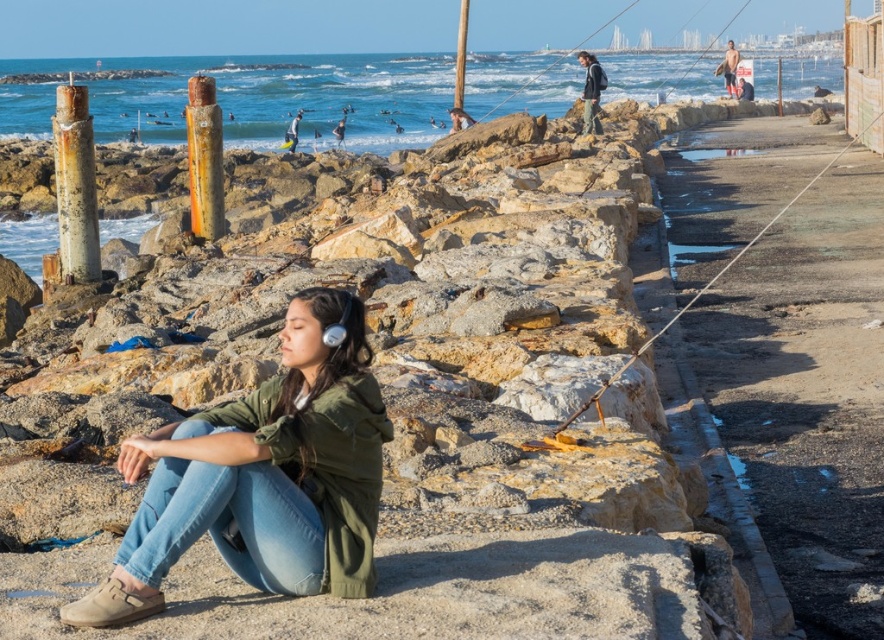
Question: Which point is closer to the camera?

Choices:
 (A) (596, 129)
 (B) (212, 97)

Answer: (B)

Question: Which of the following is the closest to the observer?

Choices:
 (A) (299, 113)
 (B) (84, 195)
 (C) (191, 83)
 (D) (593, 68)

Answer: (B)

Question: Can you confirm if rusty metal pole at upper left is positioned below tan skin surfer at upper right?

Choices:
 (A) no
 (B) yes

Answer: (B)

Question: Can you confirm if rusty metal pole at left is smaller than dark gray jacket at upper center?

Choices:
 (A) no
 (B) yes

Answer: (A)

Question: Based on their relative distances, which object is farther from the rusty metal pole at upper left?

Choices:
 (A) light blue denim jeans at center
 (B) dark gray jacket at upper center
 (C) green matte jacket at center

Answer: (C)

Question: Can you confirm if rusty metal pole at left is bigger than dark gray jacket at upper center?

Choices:
 (A) yes
 (B) no

Answer: (A)